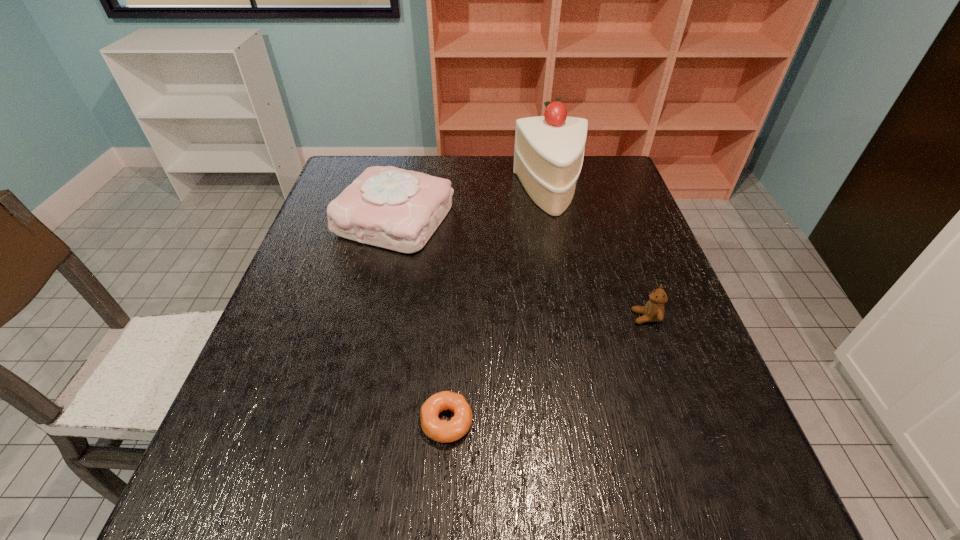
The height and width of the screenshot is (540, 960). I want to click on vacant area at the near edge, so click(567, 530).

This screenshot has width=960, height=540. In order to click on vacant space at the left edge of the desktop in this screenshot , I will do `click(243, 382)`.

In the image, there is a desktop. Where is `vacant space at the right edge`? vacant space at the right edge is located at coordinates (621, 306).

This screenshot has height=540, width=960. What are the coordinates of `free location at the far left corner` in the screenshot? It's located at (360, 166).

At what (x,y) coordinates should I click in order to perform the action: click on vacant space at the far right corner of the desktop. Please return your answer as a coordinate pair (x, y). Image resolution: width=960 pixels, height=540 pixels. Looking at the image, I should click on (602, 163).

Identify the location of free area in between the teddy bear and the doughnut. This screenshot has width=960, height=540. (546, 369).

You are a GUI agent. You are given a task and a screenshot of the screen. Output one action in this format:
    pyautogui.click(x=<x>, y=<y>)
    Task: Click on the unoccupied position between the tallest object and the doughnut
    
    Given the screenshot: What is the action you would take?
    pyautogui.click(x=498, y=307)

You are a GUI agent. You are given a task and a screenshot of the screen. Output one action in this format:
    pyautogui.click(x=<x>, y=<y>)
    Task: Click on the free area in between the second nearest object and the tallest object
    
    Given the screenshot: What is the action you would take?
    pyautogui.click(x=598, y=255)

Locate an element on the screen. free space that is in between the third object from left to right and the shorter cake is located at coordinates (473, 206).

Find the location of `vacant space in between the shortest object and the left cake`. vacant space in between the shortest object and the left cake is located at coordinates (421, 320).